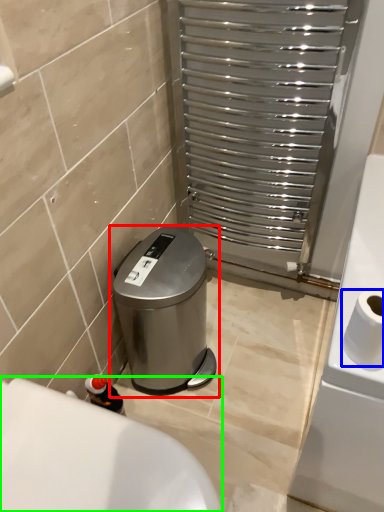
Question: Which is nearer to the waste container (highlighted by a red box)? toilet paper (highlighted by a blue box) or bath (highlighted by a green box).

Choices:
 (A) toilet paper
 (B) bath

Answer: (B)